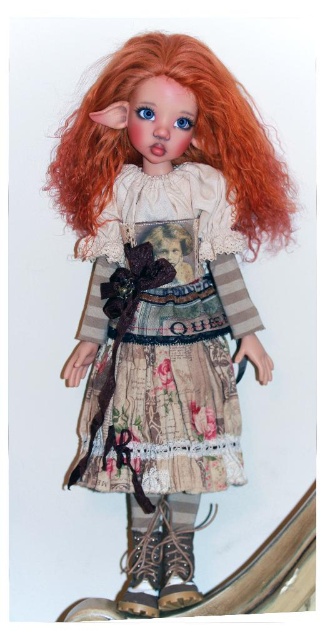
You are a fashion designer looking at the doll and want to know if the textured beige dress at center can be paired with the leather boot at lower center. Based on their sizes, is this pairing feasible?

The textured beige dress at center is bigger than the leather boot at lower center, so yes, the pairing is feasible as the dress can accommodate the boot in terms of size.